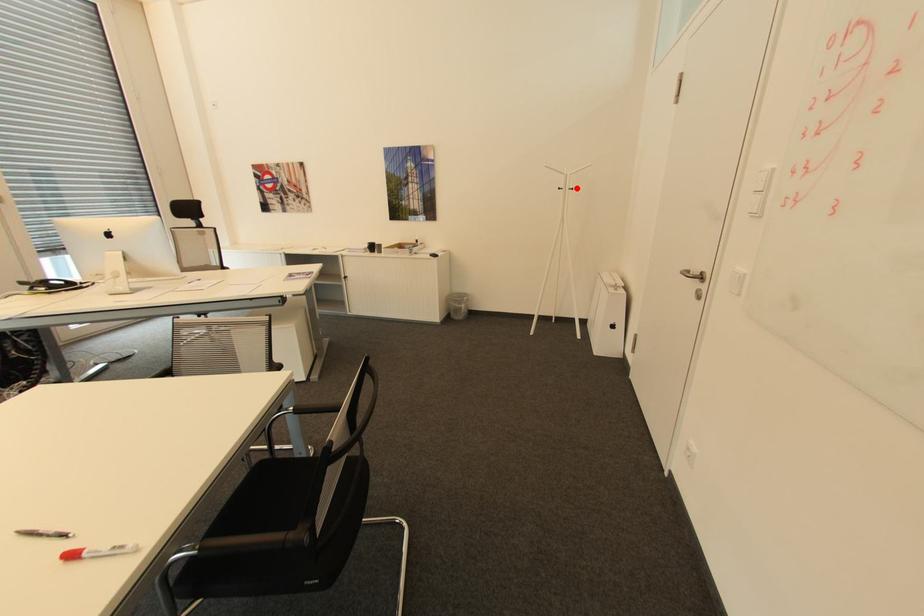
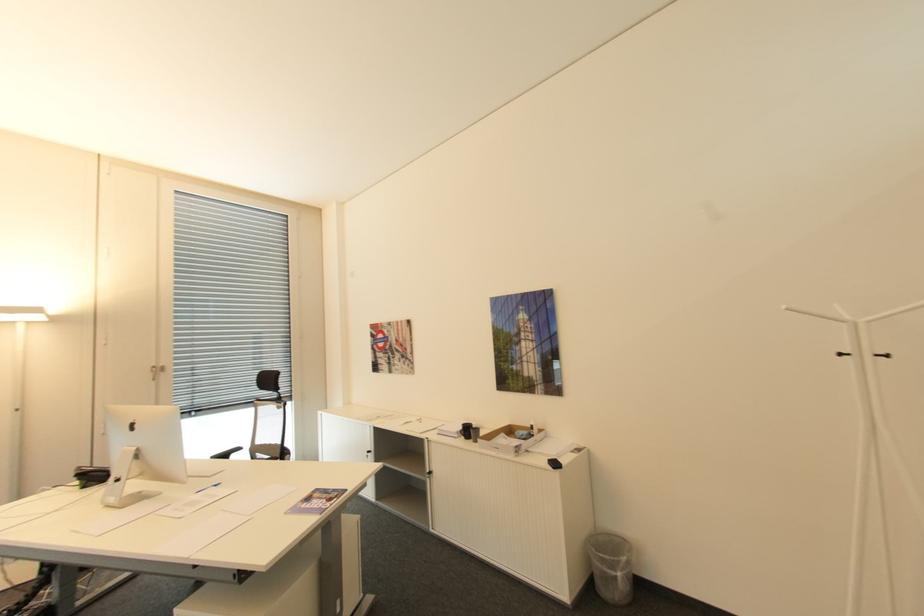
The point at the highlighted location is marked in the first image. Where is the corresponding point in the second image?

(894, 355)